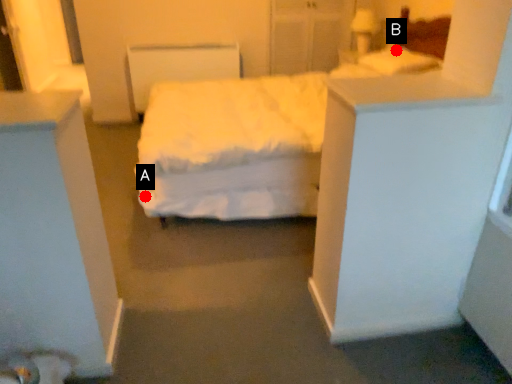
Question: Two points are circled on the image, labeled by A and B beside each circle. Which point is closer to the camera?

Choices:
 (A) A is closer
 (B) B is closer

Answer: (A)